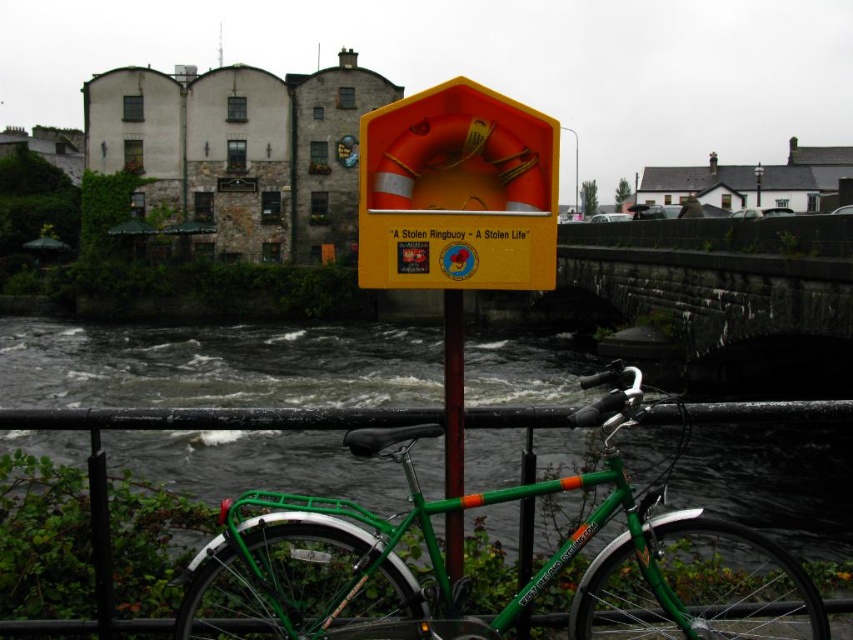
Question: Among these points, which one is farthest from the camera?

Choices:
 (A) [445, 404]
 (B) [578, 484]

Answer: (A)

Question: Estimate the real-world distances between objects in this image. Which object is closer to the green painted metal pole at center?

Choices:
 (A) green matte bicycle at lower center
 (B) orange/yellow plastic lifebuoy at center

Answer: (A)

Question: Which object is closer to the camera taking this photo?

Choices:
 (A) orange/yellow plastic lifebuoy at center
 (B) green matte bicycle at lower center

Answer: (B)

Question: Can you confirm if green matte bicycle at lower center is positioned above orange/yellow plastic lifebuoy at center?

Choices:
 (A) no
 (B) yes

Answer: (A)

Question: Can you confirm if orange/yellow plastic lifebuoy at center is positioned to the left of green painted metal pole at center?

Choices:
 (A) no
 (B) yes

Answer: (B)

Question: Can you confirm if orange/yellow plastic lifebuoy at center is positioned to the left of green painted metal pole at center?

Choices:
 (A) no
 (B) yes

Answer: (B)